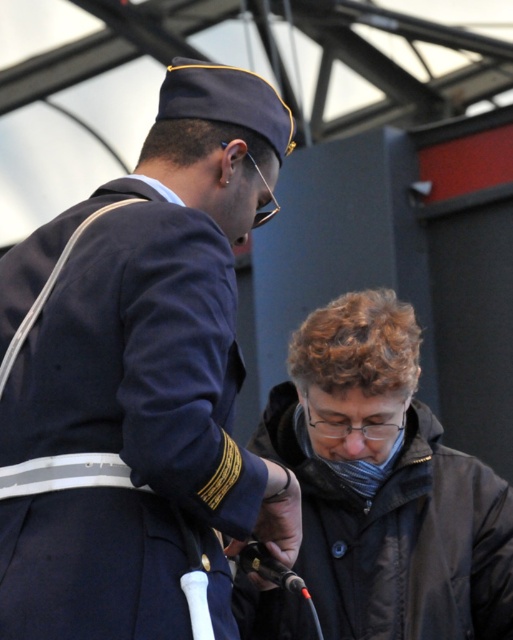
Can you confirm if navy blue uniform at upper left is thinner than black matte jacket at lower right?

Yes.

Which is more to the left, navy blue uniform at upper left or black matte jacket at lower right?

Positioned to the left is navy blue uniform at upper left.

I want to click on navy blue uniform at upper left, so 140,380.

Find the location of a particular element. This screenshot has height=640, width=513. navy blue uniform at upper left is located at coordinates (140, 380).